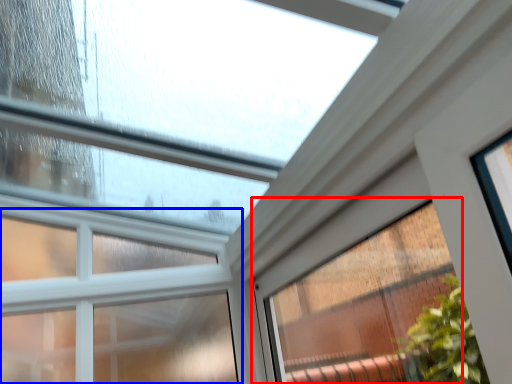
Question: Which object is further to the camera taking this photo, window (highlighted by a red box) or window (highlighted by a blue box)?

Choices:
 (A) window
 (B) window

Answer: (B)